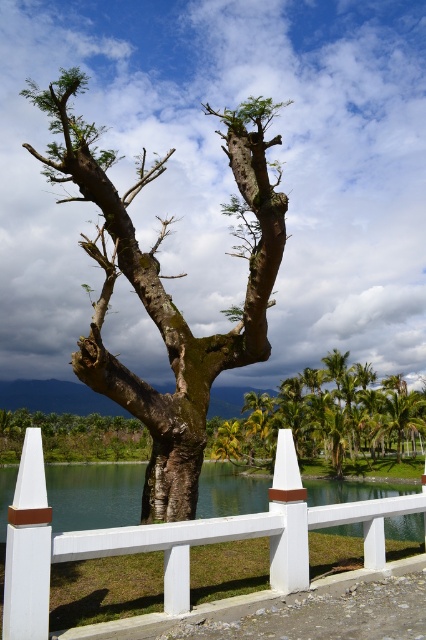
Question: Considering the real-world distances, which object is closest to the green mossy bark tree at center?

Choices:
 (A) clear water at center
 (B) smooth brown tree trunk at center

Answer: (A)

Question: Is green mossy tree at center thinner than clear water at center?

Choices:
 (A) yes
 (B) no

Answer: (A)

Question: Does green mossy bark tree at center appear on the left side of green mossy tree at center?

Choices:
 (A) no
 (B) yes

Answer: (B)

Question: Which of the following is the farthest from the observer?

Choices:
 (A) (65, 481)
 (B) (290, 468)

Answer: (A)

Question: Does clear water at center have a larger size compared to smooth brown tree trunk at center?

Choices:
 (A) yes
 (B) no

Answer: (A)

Question: Which object is the farthest from the green mossy bark tree at center?

Choices:
 (A) smooth brown tree trunk at center
 (B) clear water at center
 (C) white painted wood fence at center

Answer: (A)